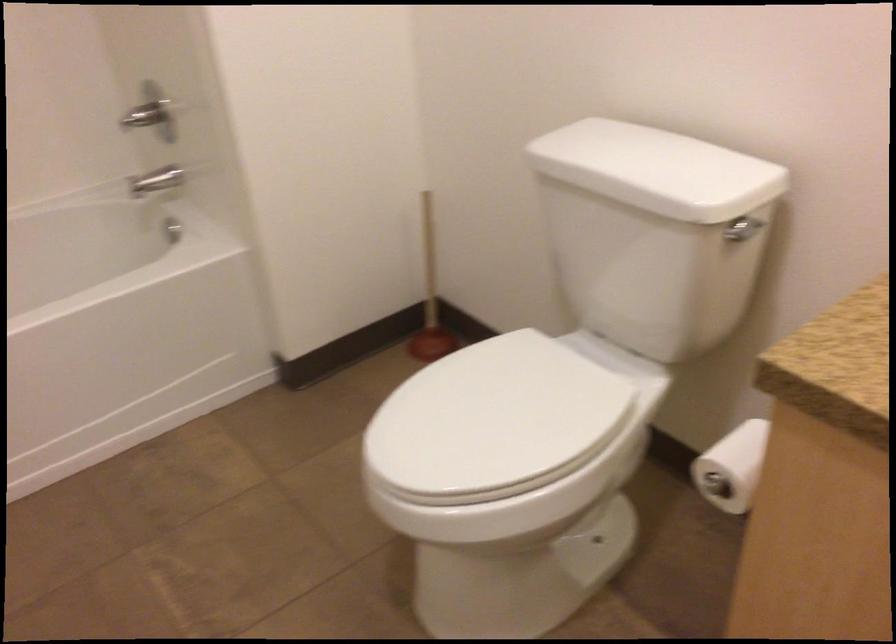
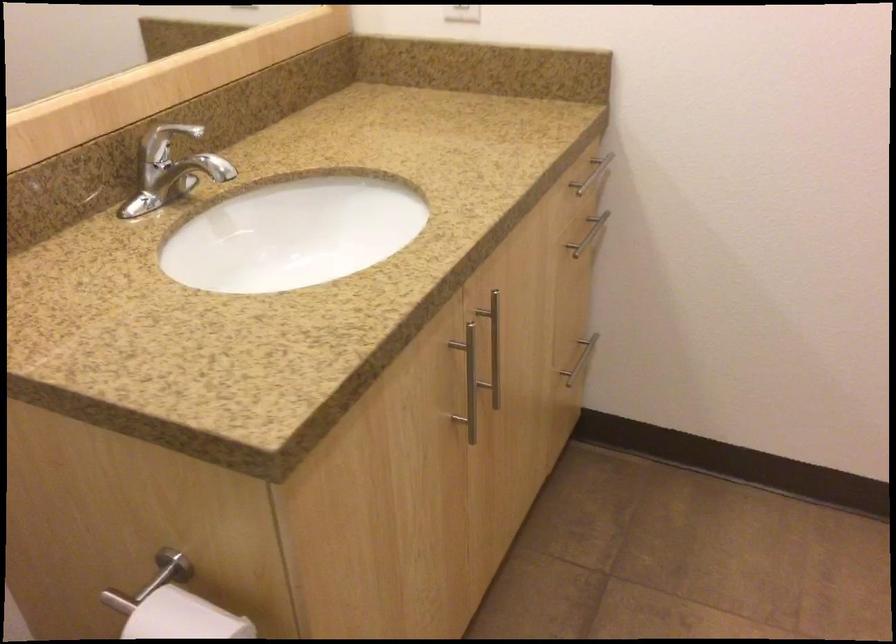
Find the pixel in the second image that matches point (771, 451) in the first image.

(183, 618)